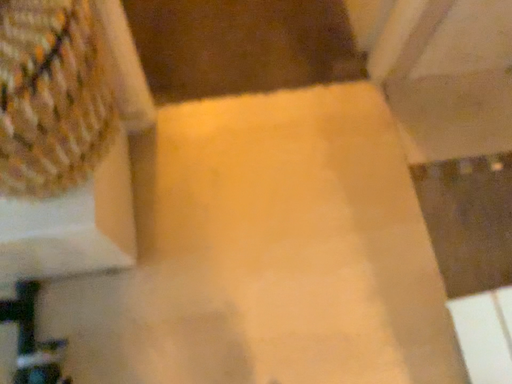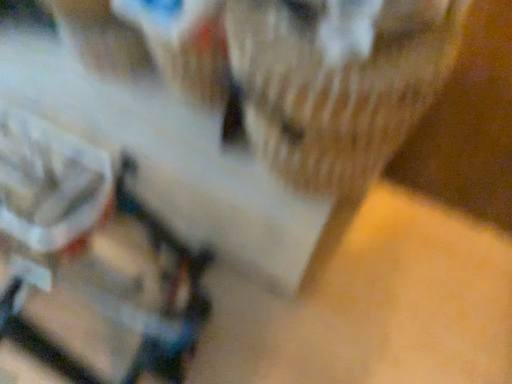
Question: Which way did the camera rotate in the video?

Choices:
 (A) rotated right
 (B) rotated left

Answer: (B)